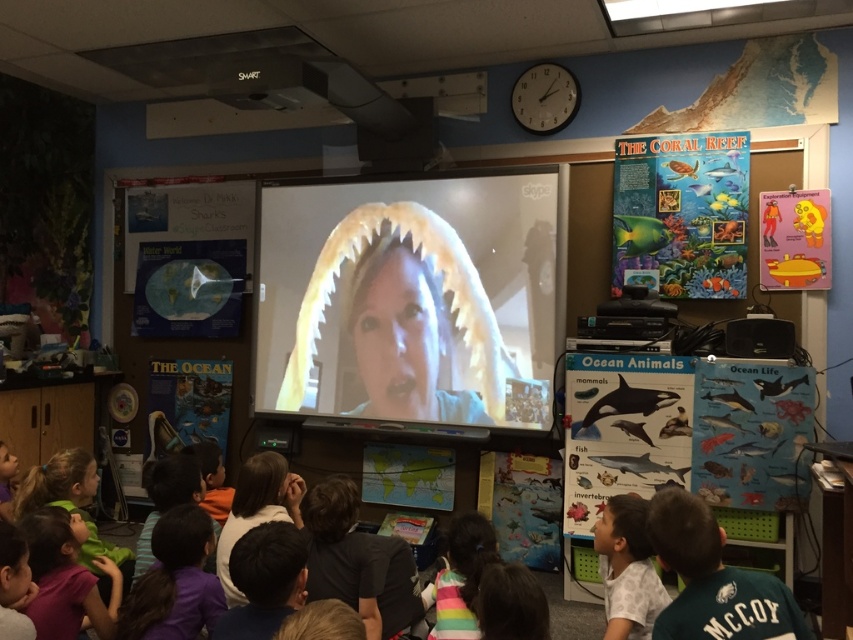
Which of these two, matte plastic screen at center or white matte shirt at lower right, stands shorter?

With less height is white matte shirt at lower right.

Is point (305, 184) positioned before point (659, 600)?

No, (305, 184) is further to viewer.

At what (x,y) coordinates should I click in order to perform the action: click on matte plastic screen at center. Please return your answer as a coordinate pair (x, y). This screenshot has height=640, width=853. Looking at the image, I should click on (410, 298).

Where is `matte plastic screen at center`? matte plastic screen at center is located at coordinates (410, 298).

Between matte plastic screen at center and green jersey at lower right, which one is positioned higher?

matte plastic screen at center is above.

Image resolution: width=853 pixels, height=640 pixels. Describe the element at coordinates (410, 298) in the screenshot. I see `matte plastic screen at center` at that location.

Which is behind, point (392, 273) or point (689, 502)?

The point (392, 273) is behind.

Locate an element on the screen. Image resolution: width=853 pixels, height=640 pixels. matte plastic screen at center is located at coordinates (410, 298).

Does white matte shirt at lower right appear on the right side of rainbow striped shirt at lower center?

Yes, white matte shirt at lower right is to the right of rainbow striped shirt at lower center.

Is white matte shirt at lower right bigger than rainbow striped shirt at lower center?

No.

Between point (637, 624) and point (462, 611), which one is positioned behind?

The point (462, 611) is behind.

The width and height of the screenshot is (853, 640). What are the coordinates of `white matte shirt at lower right` in the screenshot? It's located at (627, 570).